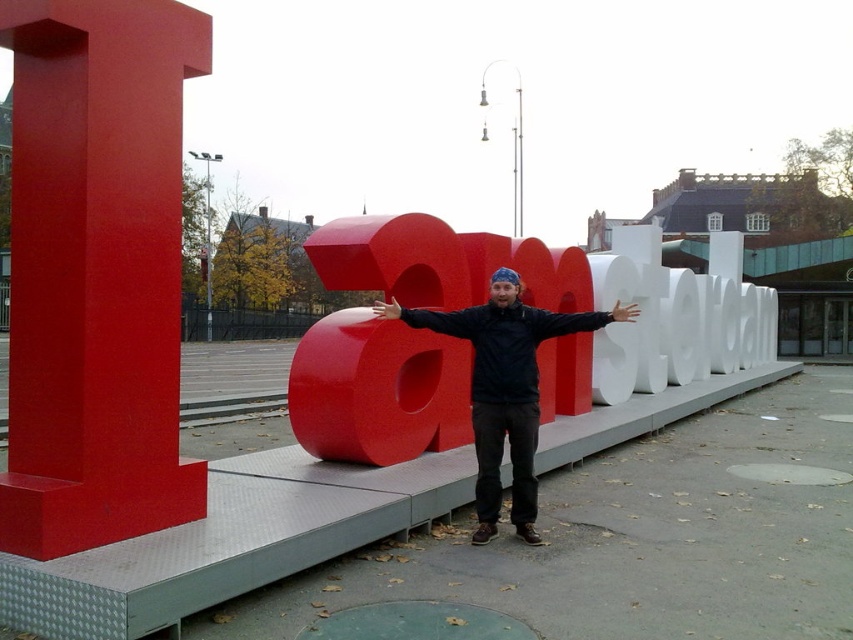
You are a photographer at the Amsterdam sign. You notice the dark blue jacket at center and the smooth skin hand at center. Which object is more to the left?

The dark blue jacket at center is more to the left because it is positioned on the left side of the smooth skin hand at center.

You are a photographer aiming to capture the perfect shot of the person posing with the Amsterdam sign. You notice the matte black arm at center and the smooth skin hand at center. Which object should you focus on if you want to highlight something closer to the camera?

The smooth skin hand at center is closer to the camera than the matte black arm at center since it has a greater height in the frame.

You are a photographer trying to capture a photo of the person in front of the Amsterdam sign. You notice the dark blue jacket at center and the matte red hand at center. Which object should you adjust your camera focus on first if you want to ensure the person is sharp in the photo?

The dark blue jacket at center is to the right of matte red hand at center. Since the jacket is part of the person, you should focus on the dark blue jacket at center first to ensure the person is sharp.